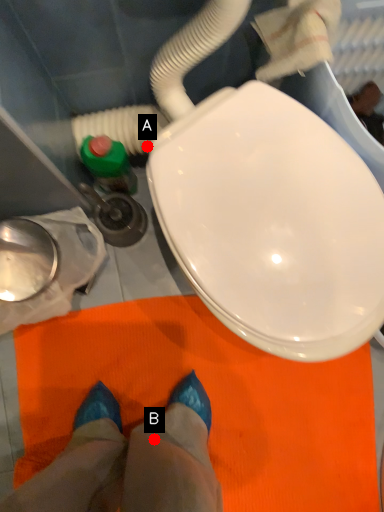
Question: Two points are circled on the image, labeled by A and B beside each circle. Which point is further to the camera?

Choices:
 (A) A is further
 (B) B is further

Answer: (A)